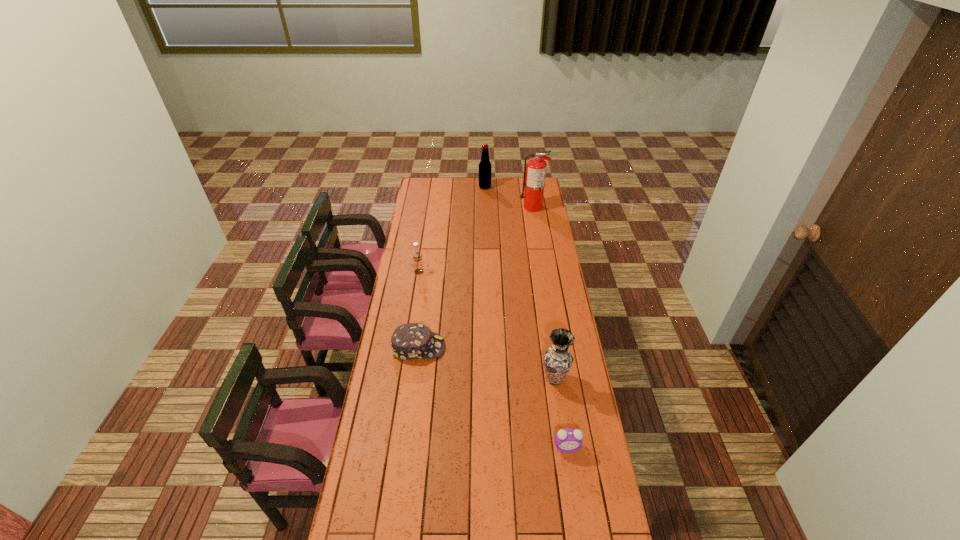
The width and height of the screenshot is (960, 540). Find the location of `blank area located 0.200m at the nozzle of the fire extinguisher`. blank area located 0.200m at the nozzle of the fire extinguisher is located at coordinates point(488,207).

Image resolution: width=960 pixels, height=540 pixels. What are the coordinates of `free location located 0.200m at the nozzle of the fire extinguisher` in the screenshot? It's located at (488, 207).

Where is `free spot located on the left of the fourth object from right to left`? The image size is (960, 540). free spot located on the left of the fourth object from right to left is located at coordinates (430, 187).

You are a GUI agent. You are given a task and a screenshot of the screen. Output one action in this format:
    pyautogui.click(x=<x>, y=<y>)
    Task: Click on the blank space located on the back of the vase
    The width and height of the screenshot is (960, 540).
    Given the screenshot: What is the action you would take?
    pyautogui.click(x=544, y=309)

Identify the location of free space located on the front label of the third farthest object. (415, 299).

You are a GUI agent. You are given a task and a screenshot of the screen. Output one action in this format:
    pyautogui.click(x=<x>, y=<y>)
    Task: Click on the blank space located on the front-facing side of the headwear
    The width and height of the screenshot is (960, 540).
    Given the screenshot: What is the action you would take?
    pyautogui.click(x=505, y=347)

Image resolution: width=960 pixels, height=540 pixels. What are the coordinates of `free space located 0.070m on the face of the alarm clock` in the screenshot? It's located at (571, 472).

Locate an element on the screen. object that is at the far edge is located at coordinates (485, 166).

Find the location of a particular element. Image resolution: width=960 pixels, height=540 pixels. vodka situated at the left edge is located at coordinates tap(417, 258).

Find the location of `headwear that is at the left edge`. headwear that is at the left edge is located at coordinates (410, 341).